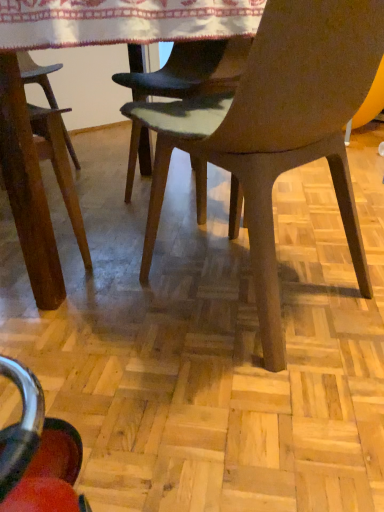
Identify the location of free spot behind matte brown chair at center. This screenshot has width=384, height=512. (226, 219).